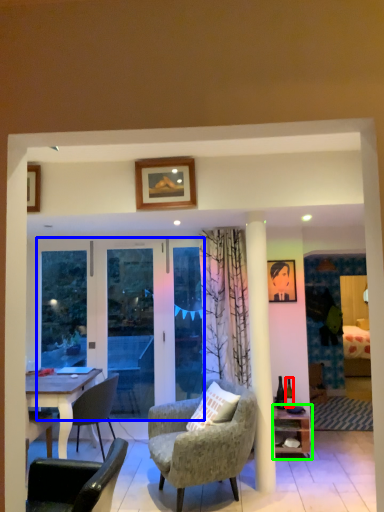
Question: Considering the real-world distances, which object is farthest from bottle (highlighted by a red box)? screen door (highlighted by a blue box) or shelf (highlighted by a green box)?

Choices:
 (A) screen door
 (B) shelf

Answer: (A)